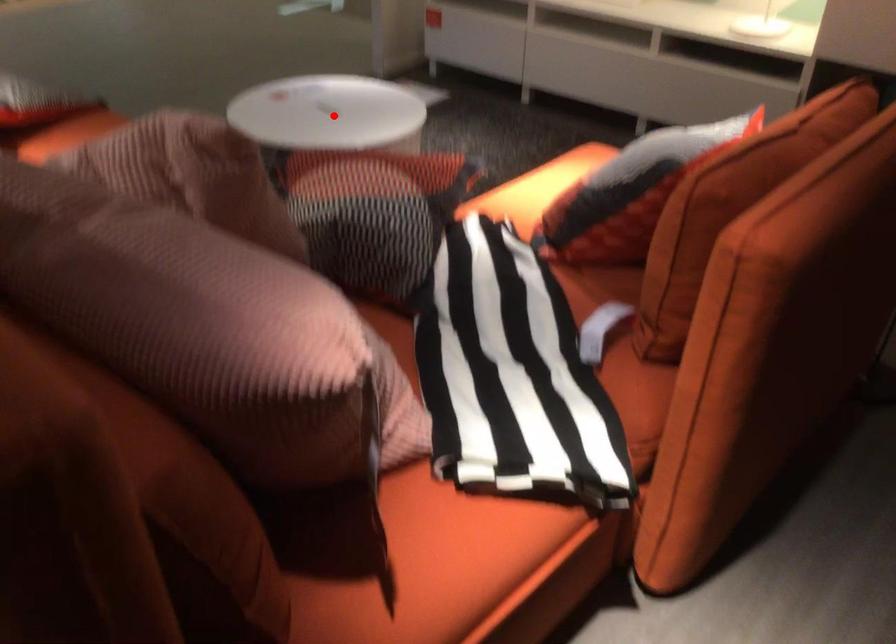
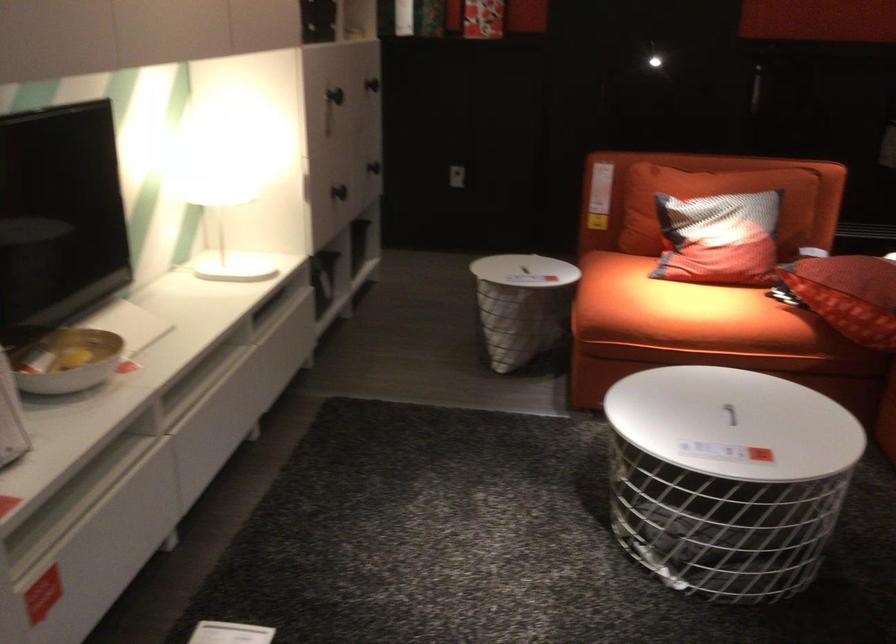
The point at the highlighted location is marked in the first image. Where is the corresponding point in the second image?

(729, 413)